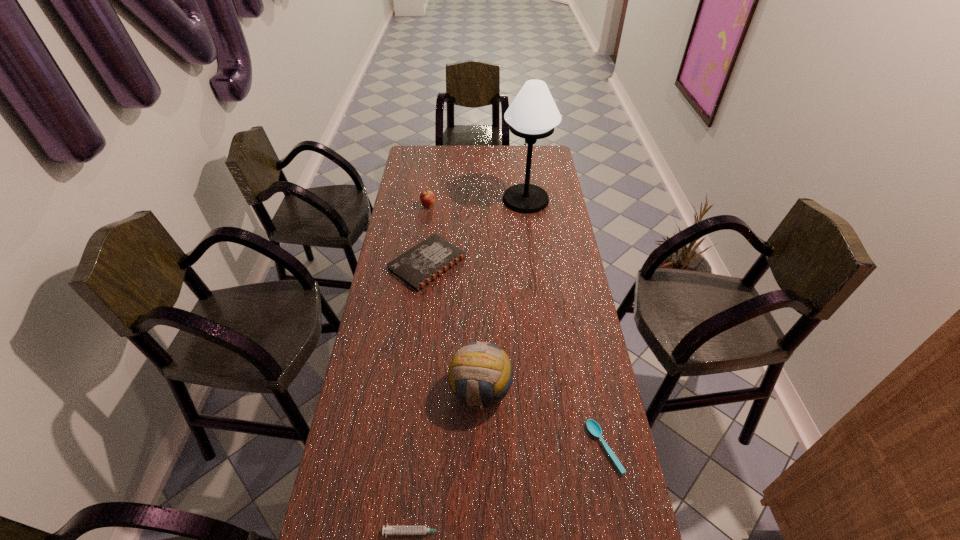
You are a GUI agent. You are given a task and a screenshot of the screen. Output one action in this format:
    pyautogui.click(x=<x>, y=<y>)
    Task: Click on the table lamp
    The image size is (960, 540).
    Given the screenshot: What is the action you would take?
    pyautogui.click(x=533, y=114)

At what (x,y) coordinates should I click in order to perform the action: click on the fourth farthest object. Please return your answer as a coordinate pair (x, y). Looking at the image, I should click on (476, 360).

Identify the location of the fifth shortest object. (476, 360).

I want to click on apple, so click(427, 198).

Locate an element on the screen. The height and width of the screenshot is (540, 960). the fourth nearest object is located at coordinates (417, 267).

The width and height of the screenshot is (960, 540). Find the location of `the nearest object`. the nearest object is located at coordinates (389, 530).

In order to click on syringe in this screenshot , I will do `click(389, 530)`.

Where is `the shortest object`? the shortest object is located at coordinates (594, 428).

Find the location of `the second nearest object`. the second nearest object is located at coordinates pyautogui.click(x=594, y=428).

At what (x,y) coordinates should I click in order to perform the action: click on free space located on the front of the table lamp. Please return your answer as a coordinate pair (x, y). Looking at the image, I should click on (531, 244).